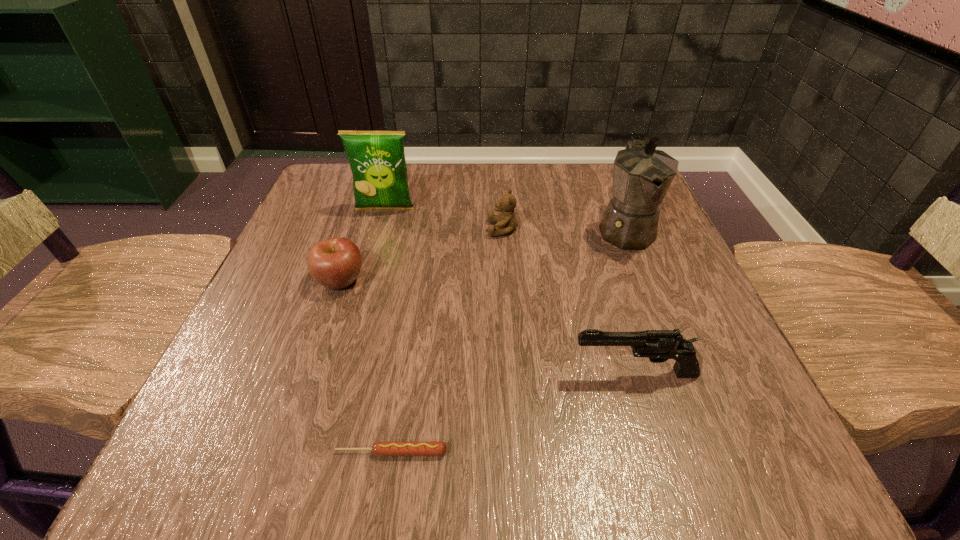
The height and width of the screenshot is (540, 960). In order to click on coffeepot in this screenshot , I will do `click(642, 175)`.

Where is `the fifth shortest object`? Image resolution: width=960 pixels, height=540 pixels. the fifth shortest object is located at coordinates (377, 160).

I want to click on gun, so click(658, 345).

In order to click on the third object from right to left in this screenshot , I will do `click(506, 222)`.

Find the location of a particular element. The width and height of the screenshot is (960, 540). the third nearest object is located at coordinates (335, 263).

Image resolution: width=960 pixels, height=540 pixels. I want to click on the nearest object, so [381, 448].

The image size is (960, 540). What are the coordinates of `the shortest object` in the screenshot? It's located at (381, 448).

I want to click on blank space located on the pouring side of the coffeepot, so click(x=687, y=386).

The height and width of the screenshot is (540, 960). I want to click on vacant space positioned 0.350m on the front-facing side of the crisp (potato chip), so click(347, 345).

Locate an element on the screen. free spot located at the end of the barrel of the fifth farthest object is located at coordinates (x=436, y=374).